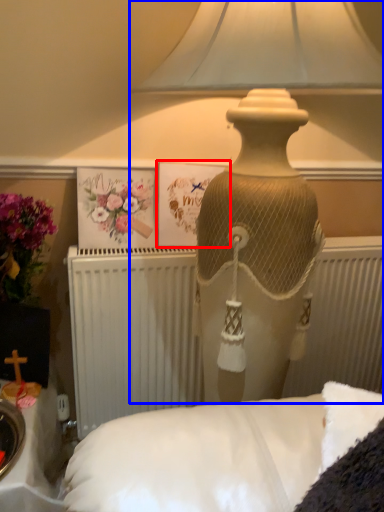
Question: Which of the following is the farthest to the observer, postcard (highlighted by a red box) or lamp (highlighted by a blue box)?

Choices:
 (A) postcard
 (B) lamp

Answer: (A)